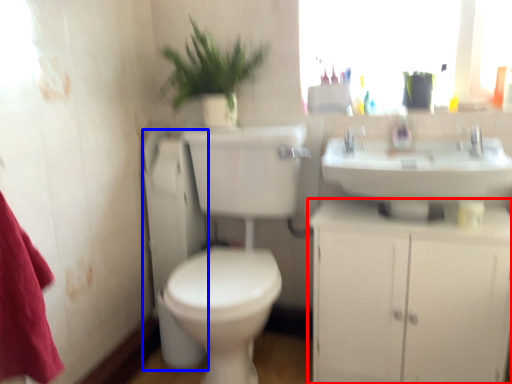
Question: Which of the following is the closest to the observer, bathroom cabinet (highlighted by a red box) or appliance (highlighted by a blue box)?

Choices:
 (A) bathroom cabinet
 (B) appliance

Answer: (A)